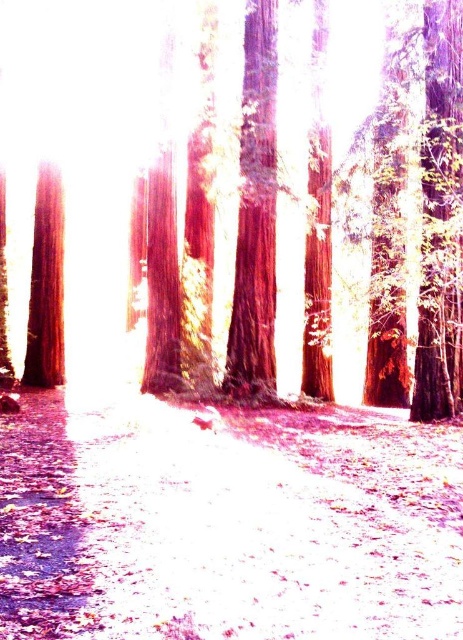
Question: Observing the image, what is the correct spatial positioning of brown dirt path at center in reference to smooth bark tree at center?

Choices:
 (A) above
 (B) below

Answer: (B)

Question: Which object is positioned farthest from the smooth bark tree at center?

Choices:
 (A) smooth brown tree trunk at left
 (B) brown dirt path at center
 (C) smooth reddish-brown tree at center

Answer: (B)

Question: Which of the following is the farthest from the observer?

Choices:
 (A) smooth reddish-brown tree at center
 (B) brown dirt path at center

Answer: (A)

Question: Is smooth bark tree at center further to camera compared to smooth brown tree trunk at left?

Choices:
 (A) no
 (B) yes

Answer: (A)

Question: Where is brown dirt path at center located in relation to smooth brown tree trunk at left in the image?

Choices:
 (A) above
 (B) below

Answer: (B)

Question: Which point is farther to the camera?

Choices:
 (A) smooth reddish-brown tree at center
 (B) smooth bark tree at center
 (C) brown dirt path at center

Answer: (B)